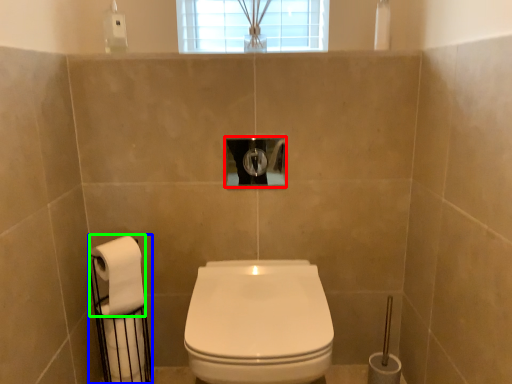
Question: Which object is positioned farthest from hole (highlighted by a red box)? Select from toilet paper (highlighted by a blue box) and toilet paper (highlighted by a green box).

Choices:
 (A) toilet paper
 (B) toilet paper

Answer: (A)